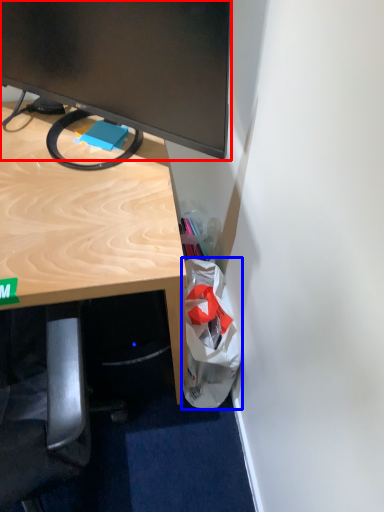
Question: Which point is closer to the camera, television (highlighted by a red box) or shopping bag (highlighted by a blue box)?

Choices:
 (A) television
 (B) shopping bag

Answer: (A)